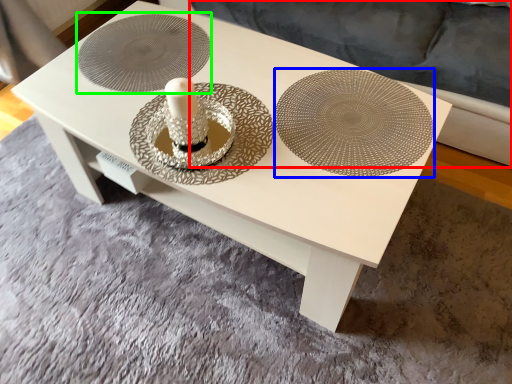
Question: Considering the real-world distances, which object is closest to couch (highlighted by a red box)? plate (highlighted by a blue box) or circle (highlighted by a green box).

Choices:
 (A) plate
 (B) circle

Answer: (A)